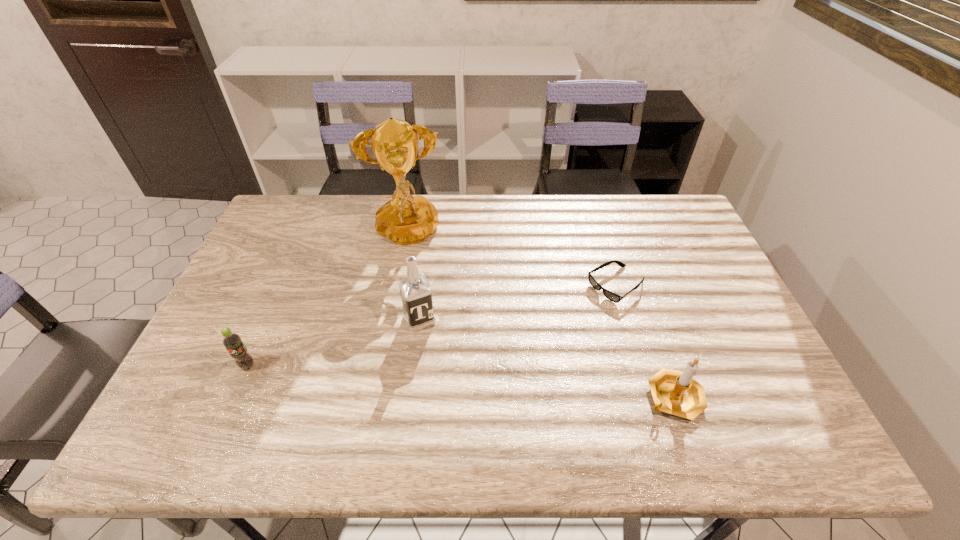
Locate an element on the screen. soda is located at coordinates (231, 341).

I want to click on candle holder, so click(x=675, y=392).

You are a GUI agent. You are given a task and a screenshot of the screen. Output one action in this format:
    pyautogui.click(x=<x>, y=<y>)
    Task: Click on the sunglasses
    
    Given the screenshot: What is the action you would take?
    pyautogui.click(x=613, y=297)

You are a GUI agent. You are given a task and a screenshot of the screen. Output one action in this format:
    pyautogui.click(x=<x>, y=<y>)
    Task: Click on the farthest object
    The image size is (960, 540).
    Given the screenshot: What is the action you would take?
    pyautogui.click(x=406, y=219)

Image resolution: width=960 pixels, height=540 pixels. I want to click on award, so click(x=406, y=219).

Locate an element on the screen. The height and width of the screenshot is (540, 960). vodka is located at coordinates (416, 293).

This screenshot has width=960, height=540. Find the location of `free spot located on the back of the candle holder`. free spot located on the back of the candle holder is located at coordinates (627, 262).

Image resolution: width=960 pixels, height=540 pixels. In order to click on vacant area situated on the front-facing side of the shortest object in this screenshot , I will do `click(526, 346)`.

Identify the location of vacant region located on the front-facing side of the shortest object. This screenshot has height=540, width=960. (535, 340).

Find the location of a particular element. This screenshot has height=540, width=960. vacant area situated on the front-facing side of the shortest object is located at coordinates (491, 370).